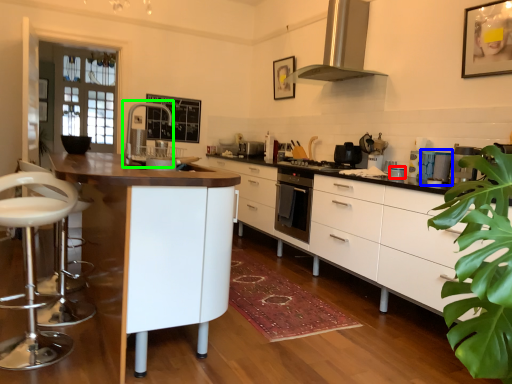
Question: Which is nearer to the appliance (highlighted by a red box)? appliance (highlighted by a blue box) or faucet (highlighted by a green box).

Choices:
 (A) appliance
 (B) faucet

Answer: (A)